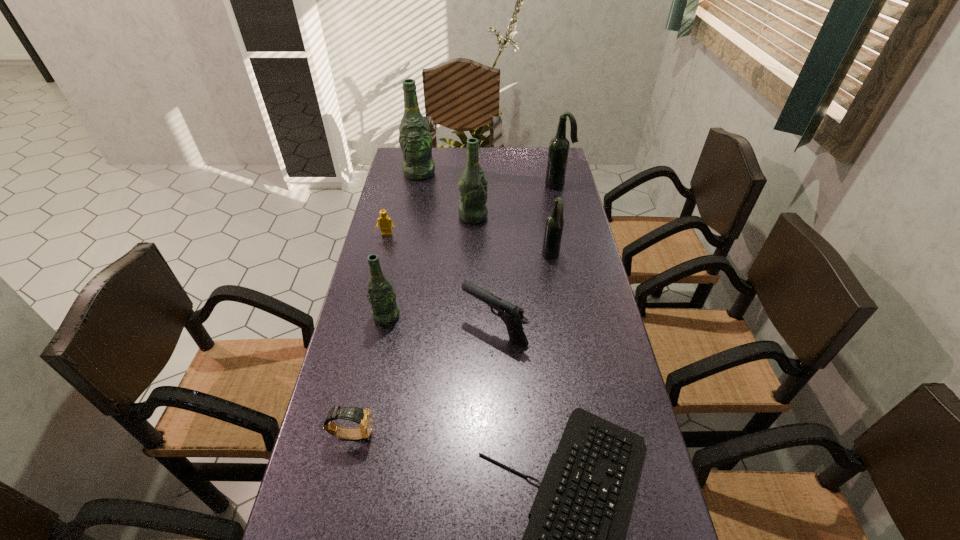
Locate an element on the screen. The width and height of the screenshot is (960, 540). the sixth tallest object is located at coordinates (512, 315).

Where is `the sixth nearest object`? the sixth nearest object is located at coordinates (386, 225).

At what (x,y) coordinates should I click in order to perform the action: click on watch. Please return your answer as a coordinate pair (x, y). This screenshot has height=540, width=960. Looking at the image, I should click on (363, 417).

Find the location of a particular element. Image resolution: width=960 pixels, height=540 pixels. vacant region located 0.140m on the surface of the tallest object is located at coordinates (414, 201).

Find the location of a particular element. This screenshot has width=960, height=540. vacant region located 0.200m on the surface of the seventh nearest object is located at coordinates (542, 216).

The image size is (960, 540). I want to click on vacant space located on the left of the farther dark beer bottle, so click(492, 185).

The width and height of the screenshot is (960, 540). I want to click on free point located on the back of the smaller dark beer bottle, so click(x=542, y=206).

Locate an element on the screen. This screenshot has width=960, height=540. vacant space situated on the surface of the nearest beer bottle is located at coordinates (380, 347).

This screenshot has width=960, height=540. Identify the location of vacant space located 0.080m at the muzzle of the gun. (433, 329).

Where is `vacant space located 0.160m at the muzzle of the gun`? The image size is (960, 540). vacant space located 0.160m at the muzzle of the gun is located at coordinates (405, 329).